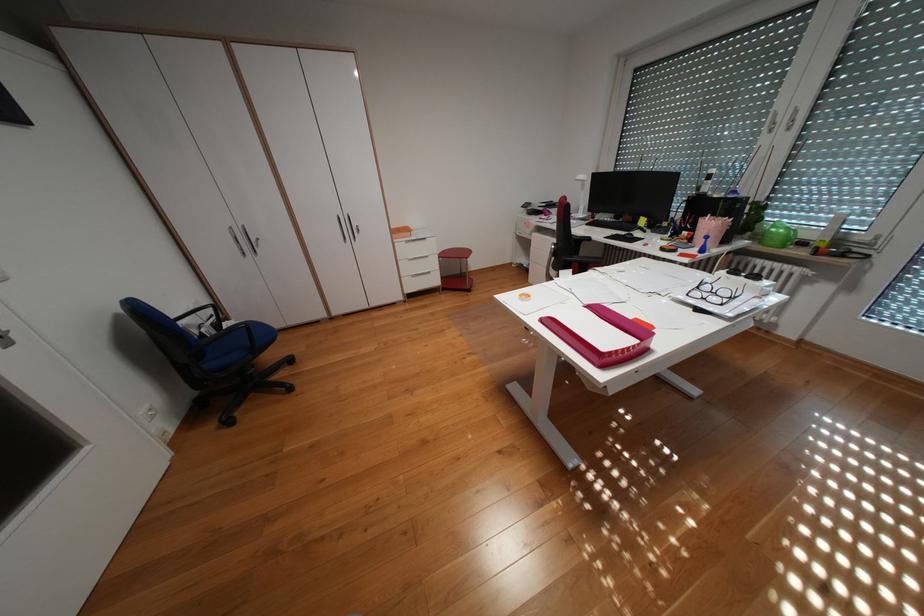
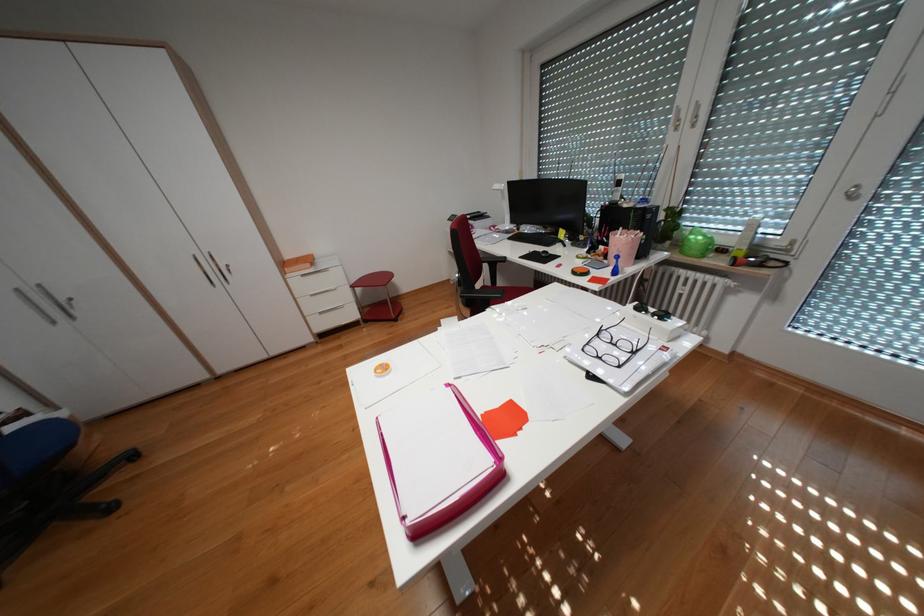
In the second image, find the point that corresponds to (x=710, y=286) in the first image.

(610, 334)